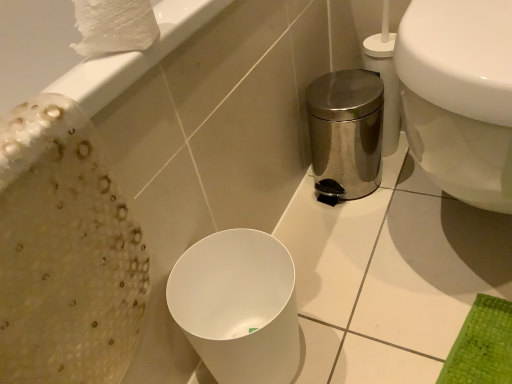
Question: Is white matte bidet at center directly adjacent to white glossy toilet at right?

Choices:
 (A) no
 (B) yes

Answer: (A)

Question: Is white matte bidet at center at the left side of white glossy toilet at right?

Choices:
 (A) yes
 (B) no

Answer: (A)

Question: Is the depth of white matte bidet at center greater than that of white glossy toilet at right?

Choices:
 (A) no
 (B) yes

Answer: (B)

Question: From a real-world perspective, is white matte bidet at center located higher than white glossy toilet at right?

Choices:
 (A) yes
 (B) no

Answer: (B)

Question: Is white matte bidet at center far from white glossy toilet at right?

Choices:
 (A) yes
 (B) no

Answer: (B)

Question: Is point (434, 168) positioned closer to the camera than point (254, 367)?

Choices:
 (A) farther
 (B) closer

Answer: (A)

Question: Choose the correct answer: Is white glossy toilet at right inside white matte bidet at center or outside it?

Choices:
 (A) inside
 (B) outside

Answer: (B)

Question: In terms of size, does white glossy toilet at right appear bigger or smaller than white matte bidet at center?

Choices:
 (A) small
 (B) big

Answer: (B)

Question: From the image's perspective, is white glossy toilet at right located above or below white matte bidet at center?

Choices:
 (A) below
 (B) above

Answer: (B)

Question: Is white textured toilet paper at upper left in front of or behind white matte bidet at center in the image?

Choices:
 (A) front
 (B) behind

Answer: (A)

Question: From their relative heights in the image, would you say white textured toilet paper at upper left is taller or shorter than white matte bidet at center?

Choices:
 (A) short
 (B) tall

Answer: (A)

Question: Is white textured toilet paper at upper left bigger or smaller than white matte bidet at center?

Choices:
 (A) small
 (B) big

Answer: (A)

Question: In the image, is white textured toilet paper at upper left on the left side or the right side of white matte bidet at center?

Choices:
 (A) right
 (B) left

Answer: (B)

Question: Considering the positions of point (212, 314) and point (84, 16), is point (212, 314) closer or farther from the camera than point (84, 16)?

Choices:
 (A) closer
 (B) farther

Answer: (B)

Question: Do you think white matte bidet at center is within white textured toilet paper at upper left, or outside of it?

Choices:
 (A) inside
 (B) outside

Answer: (B)